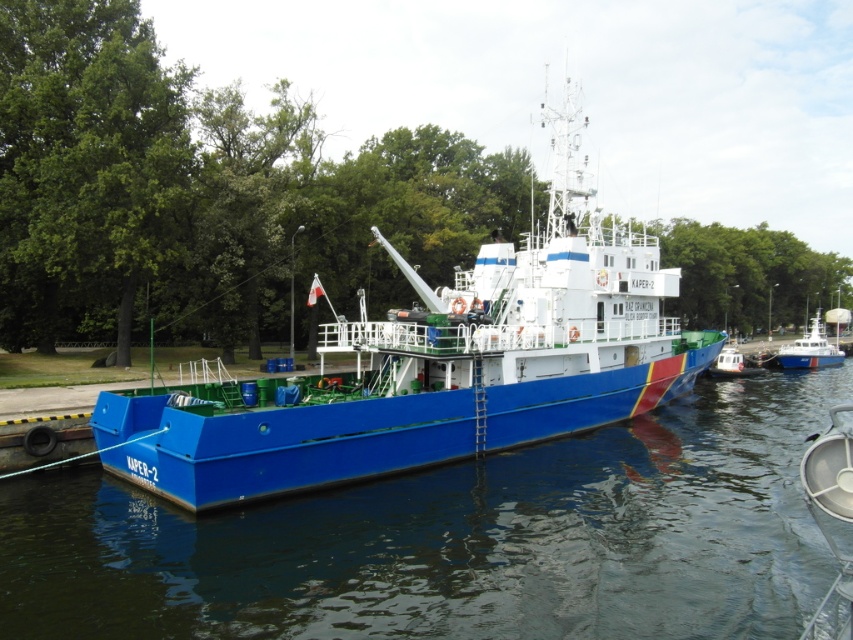
Question: Can you confirm if blue matte boat at center is positioned above white plastic boat at right?

Choices:
 (A) yes
 (B) no

Answer: (A)

Question: Observing the image, what is the correct spatial positioning of blue glossy water at center in reference to blue matte boat at center?

Choices:
 (A) left
 (B) right

Answer: (A)

Question: Which object appears closest to the camera in this image?

Choices:
 (A) blue glossy water at center
 (B) white glossy boat at center
 (C) white plastic boat at right

Answer: (A)

Question: Based on their relative distances, which object is farther from the blue matte boat at center?

Choices:
 (A) white glossy boat at center
 (B) white plastic boat at right
 (C) blue glossy water at center

Answer: (B)

Question: Which of the following is the closest to the observer?

Choices:
 (A) white glossy boat at center
 (B) blue matte boat at center

Answer: (B)

Question: Can you confirm if blue glossy water at center is wider than blue matte boat at center?

Choices:
 (A) yes
 (B) no

Answer: (B)